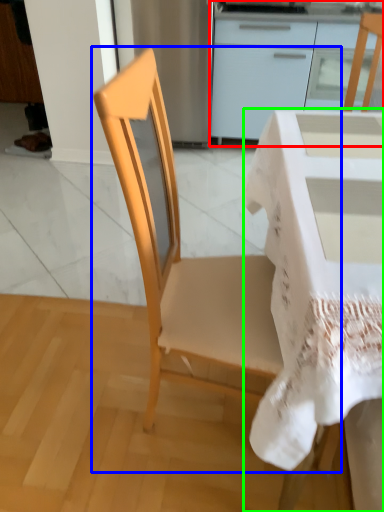
Question: Considering the real-world distances, which object is closest to cabinetry (highlighted by a red box)? chair (highlighted by a blue box) or desk (highlighted by a green box).

Choices:
 (A) chair
 (B) desk

Answer: (B)